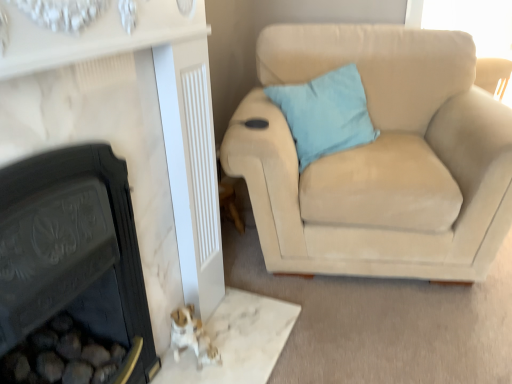
Question: Can you confirm if matte black fireplace at lower left, the second fireplace in the left-to-right sequence, is smaller than black cast iron fireplace at lower left, the second fireplace positioned from the right?

Choices:
 (A) yes
 (B) no

Answer: (B)

Question: Is matte black fireplace at lower left, the second fireplace in the left-to-right sequence, behind black cast iron fireplace at lower left, which is the 1th fireplace in left-to-right order?

Choices:
 (A) no
 (B) yes

Answer: (A)

Question: Would you consider matte black fireplace at lower left, the second fireplace in the left-to-right sequence, to be distant from black cast iron fireplace at lower left, which is the 1th fireplace in left-to-right order?

Choices:
 (A) yes
 (B) no

Answer: (B)

Question: Is matte black fireplace at lower left, positioned as the first fireplace in right-to-left order, thinner than black cast iron fireplace at lower left, the second fireplace positioned from the right?

Choices:
 (A) yes
 (B) no

Answer: (A)

Question: Could you tell me if matte black fireplace at lower left, the second fireplace in the left-to-right sequence, is turned towards black cast iron fireplace at lower left, which is the 1th fireplace in left-to-right order?

Choices:
 (A) yes
 (B) no

Answer: (A)

Question: In terms of size, does light blue fabric pillow at upper right appear bigger or smaller than black cast iron fireplace at lower left, which is the 1th fireplace in left-to-right order?

Choices:
 (A) small
 (B) big

Answer: (A)

Question: From the image's perspective, is light blue fabric pillow at upper right positioned above or below black cast iron fireplace at lower left, which is the 1th fireplace in left-to-right order?

Choices:
 (A) above
 (B) below

Answer: (A)

Question: From a real-world perspective, is light blue fabric pillow at upper right positioned above or below black cast iron fireplace at lower left, the second fireplace positioned from the right?

Choices:
 (A) below
 (B) above

Answer: (B)

Question: In the image, is light blue fabric pillow at upper right positioned in front of or behind black cast iron fireplace at lower left, which is the 1th fireplace in left-to-right order?

Choices:
 (A) front
 (B) behind

Answer: (B)

Question: Is point (278, 92) positioned closer to the camera than point (440, 82)?

Choices:
 (A) closer
 (B) farther

Answer: (A)

Question: Considering their positions, is light blue fabric pillow at upper right located in front of or behind suede beige couch at right?

Choices:
 (A) behind
 (B) front

Answer: (A)

Question: From a real-world perspective, is light blue fabric pillow at upper right above or below suede beige couch at right?

Choices:
 (A) below
 (B) above

Answer: (B)

Question: Considering the positions of light blue fabric pillow at upper right and suede beige couch at right in the image, is light blue fabric pillow at upper right bigger or smaller than suede beige couch at right?

Choices:
 (A) big
 (B) small

Answer: (B)

Question: Is black cast iron fireplace at lower left, which is the 1th fireplace in left-to-right order, wider or thinner than suede beige couch at right?

Choices:
 (A) wide
 (B) thin

Answer: (B)

Question: From a real-world perspective, relative to suede beige couch at right, is black cast iron fireplace at lower left, which is the 1th fireplace in left-to-right order, vertically above or below?

Choices:
 (A) above
 (B) below

Answer: (B)